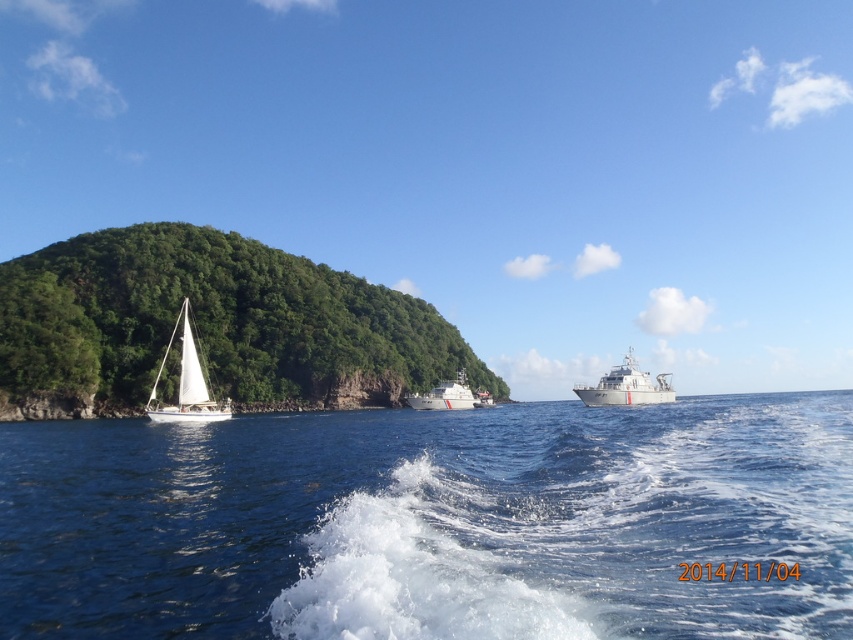
Does green leafy island at left have a smaller size compared to white sailboat at left?

Actually, green leafy island at left might be larger than white sailboat at left.

Does green leafy island at left have a lesser height compared to white sailboat at left?

No.

Find the location of a particular element. Image resolution: width=853 pixels, height=640 pixels. green leafy island at left is located at coordinates (216, 321).

Identify the location of green leafy island at left. (216, 321).

Does white sailboat at left have a greater width compared to white glossy ship at center?

Indeed, white sailboat at left has a greater width compared to white glossy ship at center.

Between white sailboat at left and white glossy ship at center, which one is positioned higher?

white sailboat at left

Image resolution: width=853 pixels, height=640 pixels. In order to click on white sailboat at left in this screenshot , I will do `click(186, 385)`.

Who is shorter, white sailboat at left or white glossy boat at center?

white glossy boat at center is shorter.

Which is more to the right, white sailboat at left or white glossy boat at center?

From the viewer's perspective, white glossy boat at center appears more on the right side.

Measure the distance between white sailboat at left and camera.

white sailboat at left and camera are 51.65 meters apart from each other.

Locate an element on the screen. Image resolution: width=853 pixels, height=640 pixels. white sailboat at left is located at coordinates (186, 385).